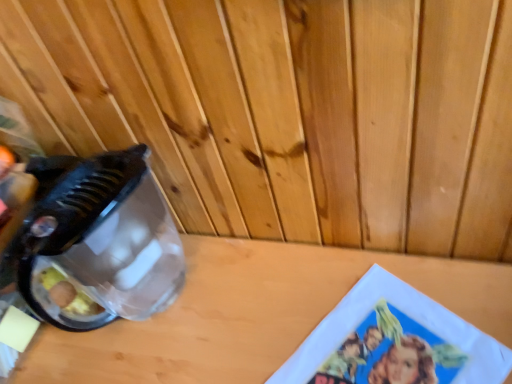
Where is `empty space that is ontop of wooden table at center (from a real-world perspective)`? This screenshot has width=512, height=384. empty space that is ontop of wooden table at center (from a real-world perspective) is located at coordinates (249, 319).